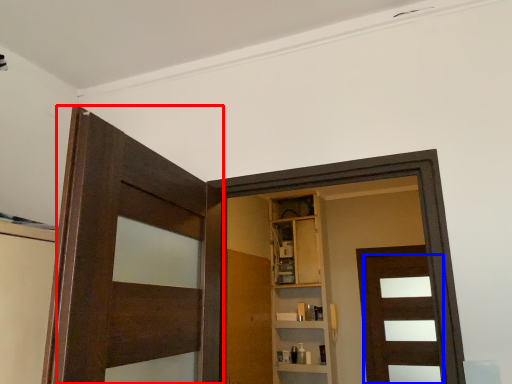
Question: Which object appears farthest to the camera in this image, door (highlighted by a red box) or door (highlighted by a blue box)?

Choices:
 (A) door
 (B) door

Answer: (B)